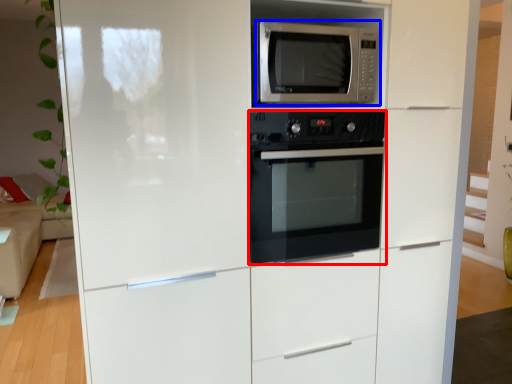
Question: Which point is closer to the camera, oven (highlighted by a red box) or microwave oven (highlighted by a blue box)?

Choices:
 (A) oven
 (B) microwave oven

Answer: (B)